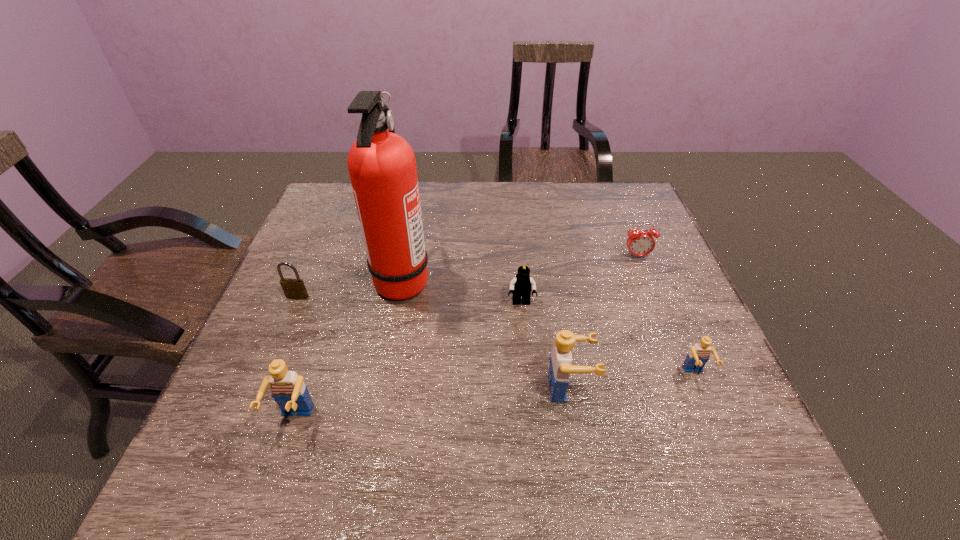
Find the location of a particular element. This screenshot has height=540, width=960. vacant position for inserting another Lego evenly is located at coordinates (436, 403).